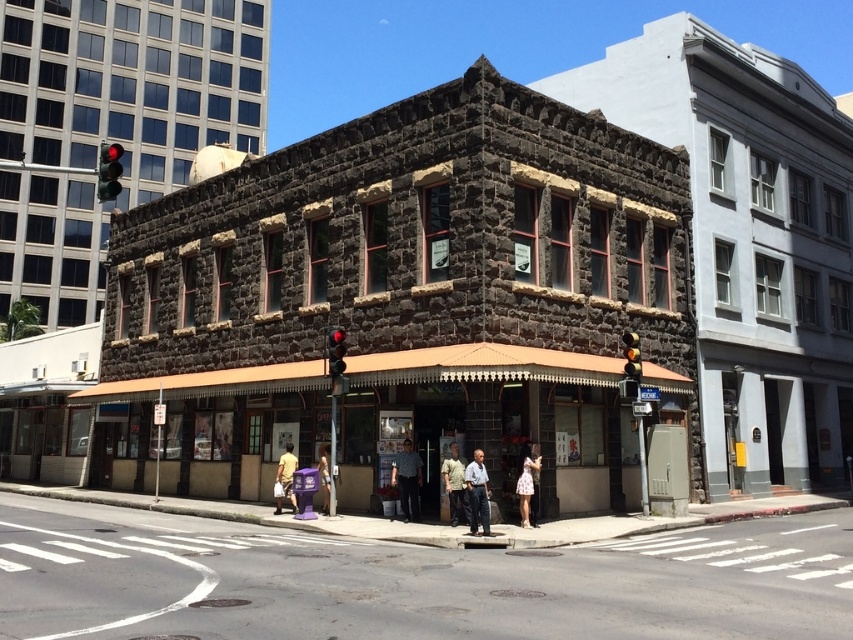
You are a delivery driver approaching the building and need to determine if your truck, which is 2 meters wide, can fit between the red glass traffic light at center and the yellow matte traffic light at upper right. Based on the scene, can you estimate if there is enough space?

The red glass traffic light at center might be wider than the yellow matte traffic light at upper right, so it is uncertain if there is enough space for the truck. You should check the actual distance before proceeding.

In the scene shown: You are a pedestrian trying to cross the street safely. You notice the gray fabric pants at center and the red glass traffic light at center. Which object is bigger in size?

The gray fabric pants at center is larger in size than the red glass traffic light at center.